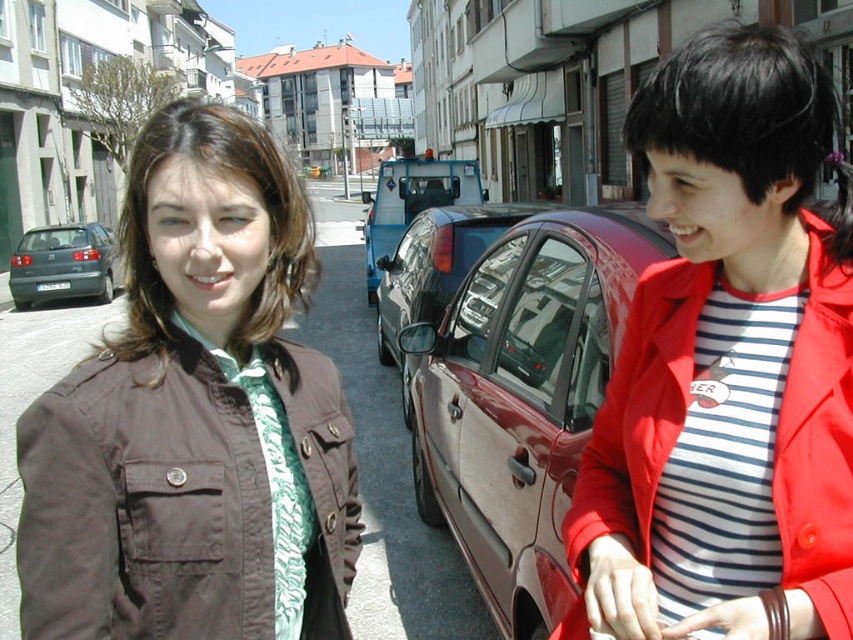
Question: Can you confirm if brown fabric jacket at left is bigger than glossy black car at center?

Choices:
 (A) yes
 (B) no

Answer: (B)

Question: Can you confirm if red matte coat at right is positioned to the right of glossy black car at center?

Choices:
 (A) yes
 (B) no

Answer: (A)

Question: Which object appears farthest from the camera in this image?

Choices:
 (A) glossy black car at center
 (B) brown fabric jacket at left
 (C) red matte coat at right
 (D) blue metallic van at center

Answer: (D)

Question: From the image, what is the correct spatial relationship of brown fabric jacket at left in relation to matte green car at left?

Choices:
 (A) left
 (B) right

Answer: (B)

Question: Among these objects, which one is nearest to the camera?

Choices:
 (A) brown fabric jacket at left
 (B) matte green car at left
 (C) blue metallic van at center

Answer: (A)

Question: Considering the real-world distances, which object is farthest from the glossy black car at center?

Choices:
 (A) red matte coat at right
 (B) blue metallic van at center
 (C) brown fabric jacket at left

Answer: (C)